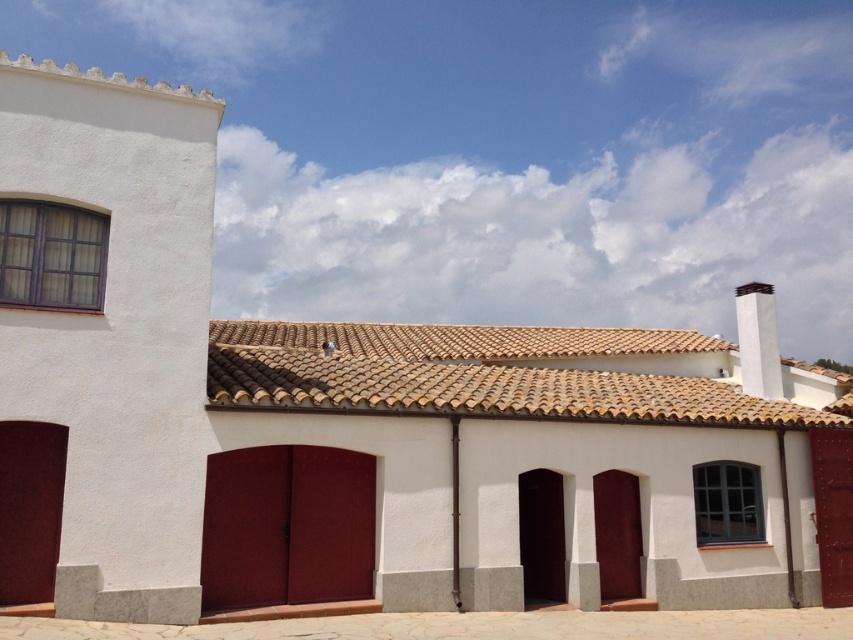
Which is more to the right, brown clay tiles at center or burgundy matte/glossy garage door at center?

brown clay tiles at center

Is point (686, 371) positioned after point (315, 512)?

Yes, it is.

Who is more forward, (344, 396) or (206, 492)?

Positioned in front is point (206, 492).

The width and height of the screenshot is (853, 640). Identify the location of brown clay tiles at center. (502, 372).

Is point (323, 529) more distant than point (740, 314)?

No, (323, 529) is closer to viewer.

Does burgundy matte/glossy garage door at center have a larger size compared to white smooth chimney at upper right?

Incorrect, burgundy matte/glossy garage door at center is not larger than white smooth chimney at upper right.

Is point (316, 468) positioned after point (758, 284)?

No, it is in front of (758, 284).

The width and height of the screenshot is (853, 640). In order to click on burgundy matte/glossy garage door at center in this screenshot , I will do `click(287, 525)`.

Is brown clay tiles at center bigger than white smooth chimney at upper right?

No.

Is brown clay tiles at center positioned in front of white smooth chimney at upper right?

That is True.

Who is more forward, (610, 340) or (764, 317)?

Point (764, 317) is more forward.

The image size is (853, 640). Find the location of `brown clay tiles at center`. brown clay tiles at center is located at coordinates (502, 372).